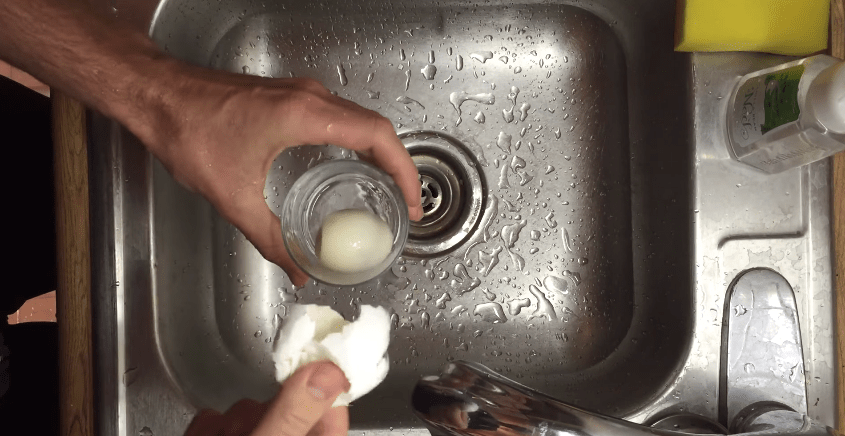
Where is `metal sink basin`? metal sink basin is located at coordinates (567, 154).